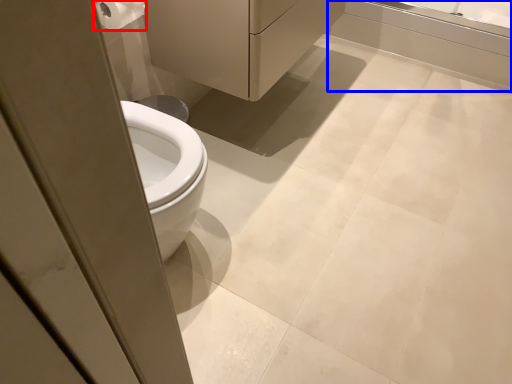
Question: Which point is further to the camera, toilet paper (highlighted by a red box) or bath (highlighted by a blue box)?

Choices:
 (A) toilet paper
 (B) bath

Answer: (B)